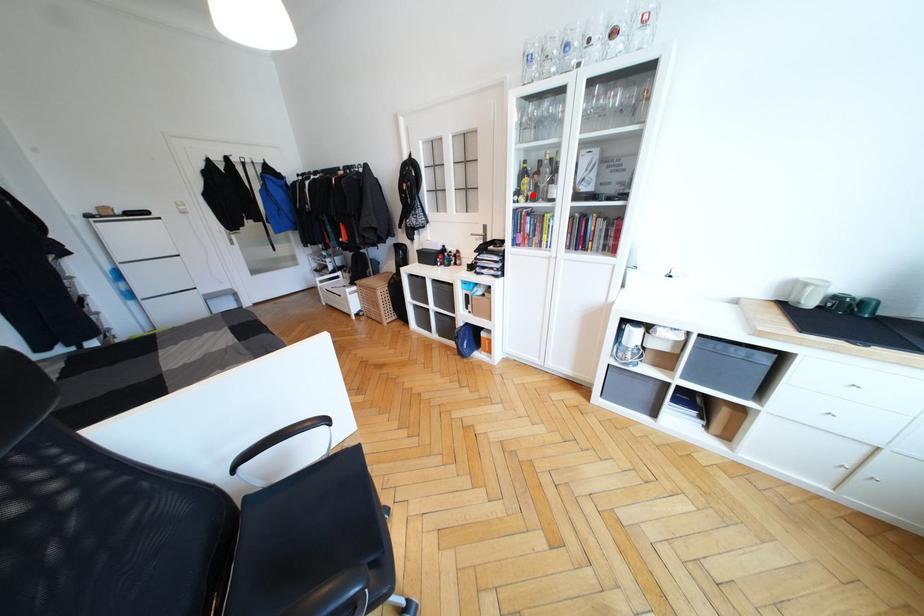
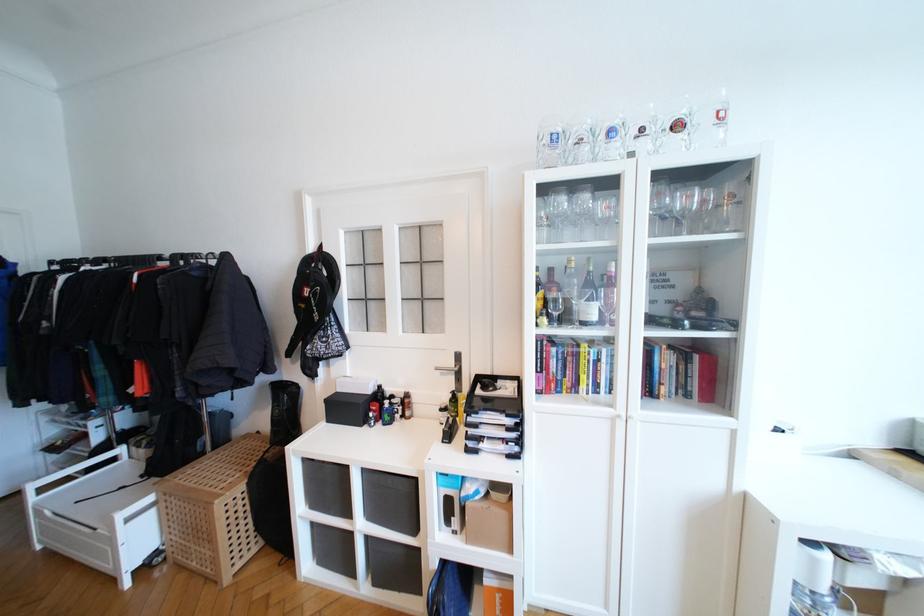
Question: I am providing you with two images of the same scene from different viewpoints. Given a red point in image1, look at the same physical point in image2. Is it:

Choices:
 (A) Closer to the viewpoint
 (B) Farther from the viewpoint

Answer: (B)